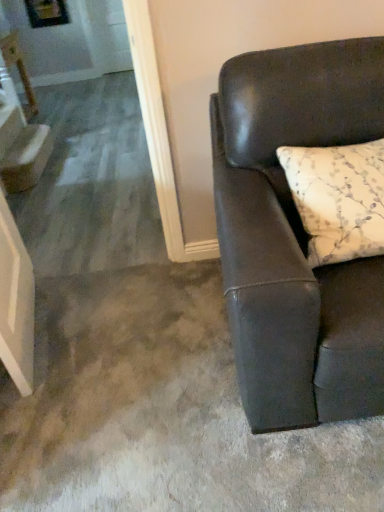
Question: From the image's perspective, is matte black couch at right located above or below white floral-patterned pillow at right?

Choices:
 (A) below
 (B) above

Answer: (A)

Question: Does point (254, 402) appear closer or farther from the camera than point (357, 253)?

Choices:
 (A) closer
 (B) farther

Answer: (A)

Question: Which object is positioned farthest from the matte white table at upper left?

Choices:
 (A) white floral-patterned pillow at right
 (B) matte black couch at right
 (C) white glossy step at left

Answer: (A)

Question: Which is farther from the matte black couch at right?

Choices:
 (A) white floral-patterned pillow at right
 (B) matte white table at upper left
 (C) white glossy step at left

Answer: (B)